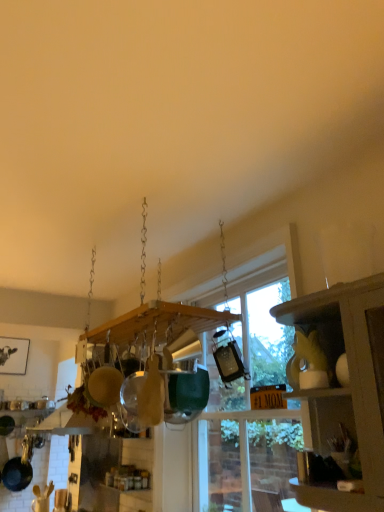
Question: Does black matte frying pan at lower left have a lesser width compared to matte yellow cabinet at right?

Choices:
 (A) no
 (B) yes

Answer: (B)

Question: From a real-world perspective, is black matte frying pan at lower left on matte yellow cabinet at right?

Choices:
 (A) yes
 (B) no

Answer: (B)

Question: Is black matte frying pan at lower left positioned far away from matte yellow cabinet at right?

Choices:
 (A) no
 (B) yes

Answer: (B)

Question: From a real-world perspective, is black matte frying pan at lower left physically below matte yellow cabinet at right?

Choices:
 (A) yes
 (B) no

Answer: (A)

Question: Is black matte frying pan at lower left facing away from matte yellow cabinet at right?

Choices:
 (A) no
 (B) yes

Answer: (A)

Question: Relative to black matte frying pan at lower left, is matte yellow cabinet at right in front or behind?

Choices:
 (A) front
 (B) behind

Answer: (A)

Question: From a real-world perspective, is matte yellow cabinet at right above or below black matte frying pan at lower left?

Choices:
 (A) below
 (B) above

Answer: (B)

Question: In terms of height, does matte yellow cabinet at right look taller or shorter compared to black matte frying pan at lower left?

Choices:
 (A) short
 (B) tall

Answer: (B)

Question: Is matte yellow cabinet at right wider or thinner than black matte frying pan at lower left?

Choices:
 (A) thin
 (B) wide

Answer: (B)

Question: Is matte yellow cabinet at right taller or shorter than transparent glass window at center?

Choices:
 (A) tall
 (B) short

Answer: (B)

Question: In terms of width, does matte yellow cabinet at right look wider or thinner when compared to transparent glass window at center?

Choices:
 (A) thin
 (B) wide

Answer: (B)

Question: In the image, is matte yellow cabinet at right on the left side or the right side of transparent glass window at center?

Choices:
 (A) right
 (B) left

Answer: (A)

Question: Relative to transparent glass window at center, is matte yellow cabinet at right in front or behind?

Choices:
 (A) front
 (B) behind

Answer: (A)

Question: Considering their positions, is black matte frying pan at lower left located in front of or behind matte yellow cabinet at right?

Choices:
 (A) behind
 (B) front

Answer: (A)

Question: Based on their positions, is black matte frying pan at lower left located to the left or right of matte yellow cabinet at right?

Choices:
 (A) left
 (B) right

Answer: (A)